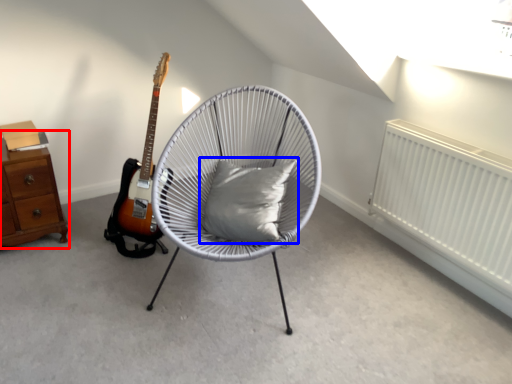
Question: Which object is closer to the camera taking this photo, chest of drawers (highlighted by a red box) or pillow (highlighted by a blue box)?

Choices:
 (A) chest of drawers
 (B) pillow

Answer: (B)